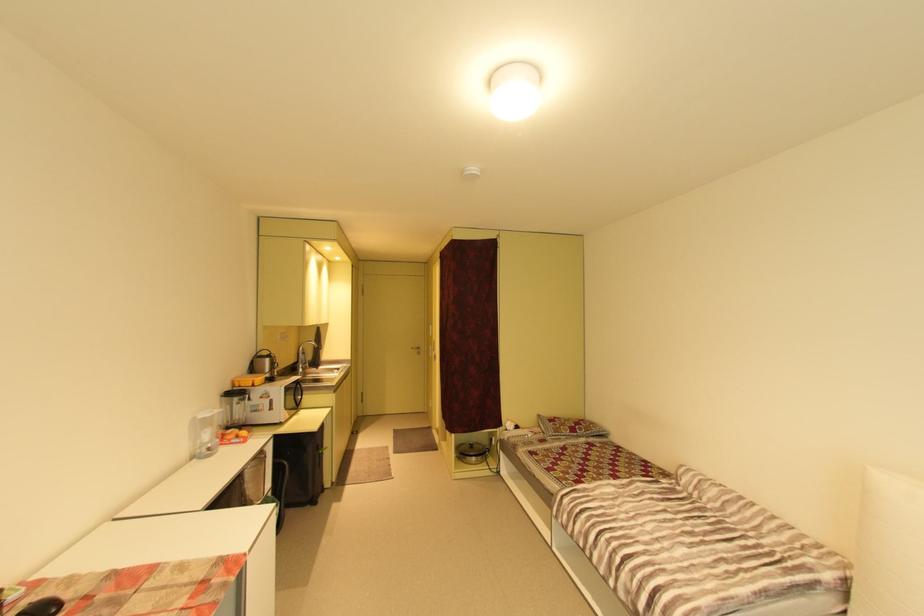
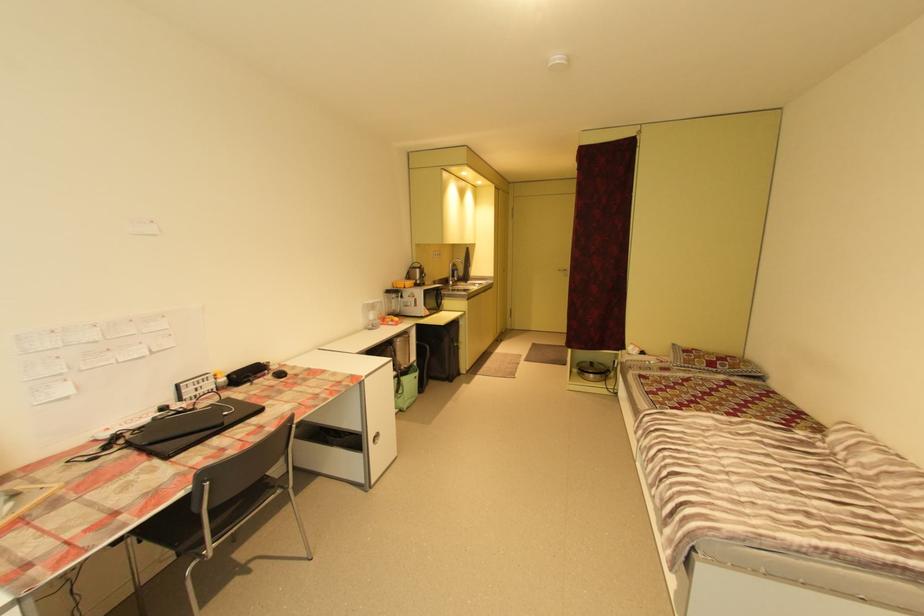
The point at (478, 445) is marked in the first image. Where is the corresponding point in the second image?

(598, 363)